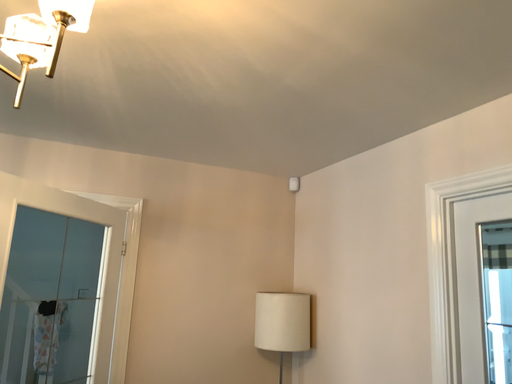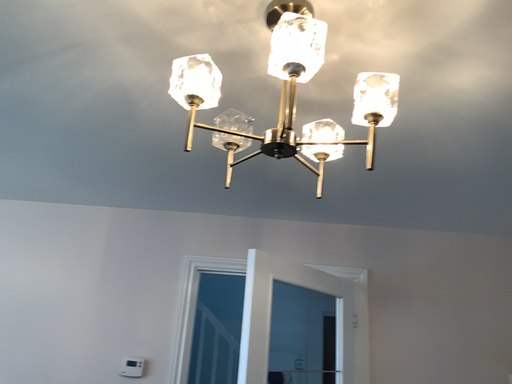
Question: How did the camera likely rotate when shooting the video?

Choices:
 (A) rotated downward
 (B) rotated upward

Answer: (B)